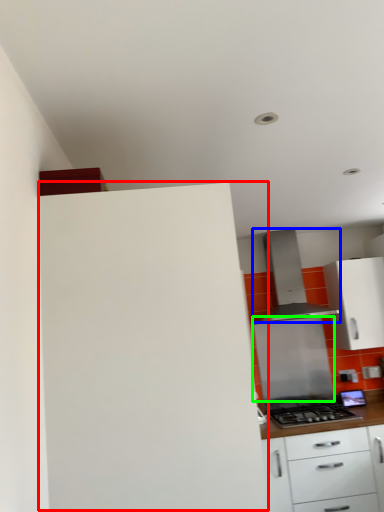
Question: Which object is the closest to the cabinetry (highlighted by a red box)? Choose among these: kitchen appliance (highlighted by a blue box) or appliance (highlighted by a green box).

Choices:
 (A) kitchen appliance
 (B) appliance

Answer: (A)